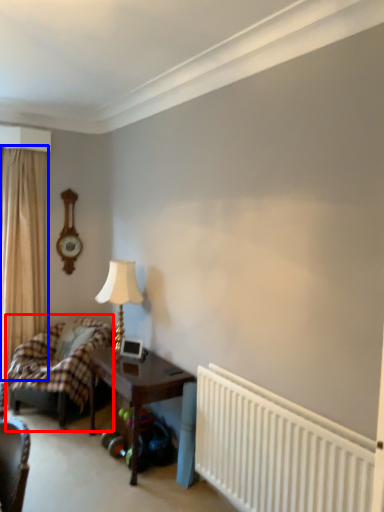
Question: Among these objects, which one is nearest to the camera, bed (highlighted by a red box) or curtain (highlighted by a blue box)?

Choices:
 (A) bed
 (B) curtain

Answer: (A)